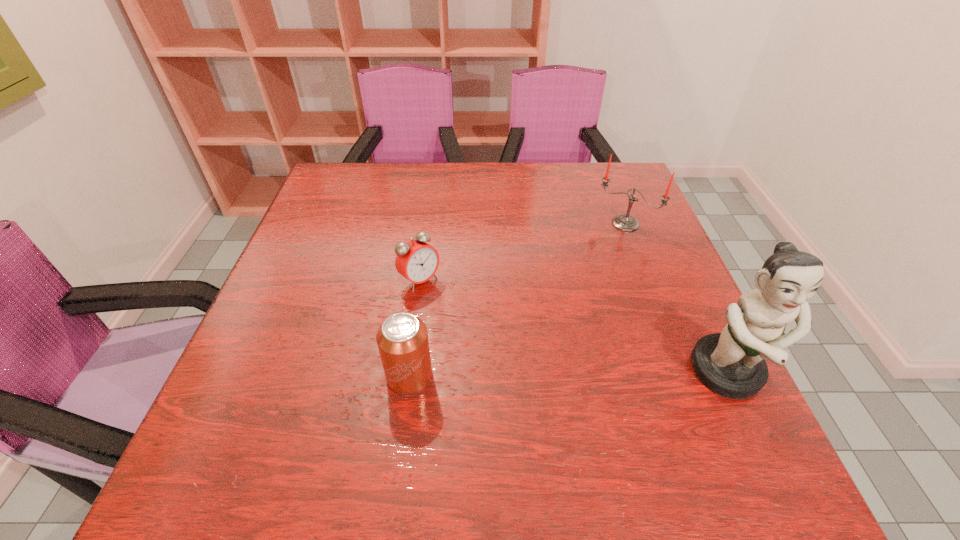
The image size is (960, 540). I want to click on blank region between the third nearest object and the farthest object, so click(522, 252).

The height and width of the screenshot is (540, 960). Identify the location of free space between the second tallest object and the figurine. (677, 299).

Find the location of a particular element. Image resolution: width=960 pixels, height=540 pixels. object that is the second nearest to the tallest object is located at coordinates (402, 339).

Select which object is the closest to the third nearest object. Please provide its 2D coordinates. Your answer should be formatted as a tuple, i.e. [(x, y)], where the tuple contains the x and y coordinates of a point satisfying the conditions above.

[(402, 339)]

I want to click on vacant space that satisfies the following two spatial constraints: 1. on the back side of the can; 2. on the right side of the farthest object, so click(x=430, y=224).